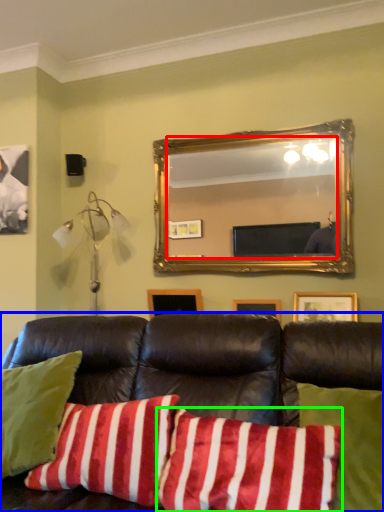
Question: Which object is positioned closest to mirror (highlighted by a red box)? Select from studio couch (highlighted by a blue box) and pillow (highlighted by a green box).

Choices:
 (A) studio couch
 (B) pillow

Answer: (A)